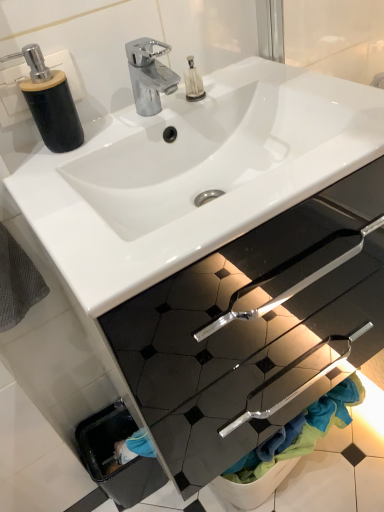
Describe the element at coordinates (48, 101) in the screenshot. The image size is (384, 512). I see `matte black soap dispenser at upper left` at that location.

The width and height of the screenshot is (384, 512). Find the location of `white glossy sink at center`. white glossy sink at center is located at coordinates (193, 174).

Which object is further away from the camera, white glossy sink at center or gray textured towel at lower left?

gray textured towel at lower left.

In the scene shown: Is white glossy sink at center to the left of gray textured towel at lower left from the viewer's perspective?

In fact, white glossy sink at center is to the right of gray textured towel at lower left.

From a real-world perspective, which object stands above the other?

From a 3D spatial view, gray textured towel at lower left is above.

Are white glossy sink at center and gray textured towel at lower left beside each other?

No, white glossy sink at center is not in contact with gray textured towel at lower left.

From the image's perspective, is white glossy sink at center beneath matte black soap dispenser at upper left?

Indeed, from the image's perspective, white glossy sink at center is shown beneath matte black soap dispenser at upper left.

Is there a large distance between white glossy sink at center and matte black soap dispenser at upper left?

white glossy sink at center is near matte black soap dispenser at upper left, not far away.

Is the depth of white glossy sink at center less than that of matte black soap dispenser at upper left?

Yes, white glossy sink at center is closer to the camera.

Is white glossy sink at center aimed at matte black soap dispenser at upper left?

No.

From a real-world perspective, is gray textured towel at lower left physically above white glossy sink at center?

Correct, in the physical world, gray textured towel at lower left is higher than white glossy sink at center.

At what (x,y) coordinates should I click in order to perform the action: click on sink above the gray textured towel at lower left (from the image's perspective). Please return your answer as a coordinate pair (x, y). Looking at the image, I should click on (193, 174).

Is gray textured towel at lower left far from white glossy sink at center?

No, there isn't a large distance between gray textured towel at lower left and white glossy sink at center.

Can you tell me how much matte black soap dispenser at upper left and gray textured towel at lower left differ in facing direction?

The facing directions of matte black soap dispenser at upper left and gray textured towel at lower left are 0.981 degrees apart.

Considering the positions of points (47, 92) and (26, 281), is point (47, 92) closer to camera compared to point (26, 281)?

Yes.

Which object is wider, matte black soap dispenser at upper left or gray textured towel at lower left?

Wider between the two is gray textured towel at lower left.

Is matte black soap dispenser at upper left looking in the opposite direction of gray textured towel at lower left?

No, gray textured towel at lower left is not at the back of matte black soap dispenser at upper left.

You are a GUI agent. You are given a task and a screenshot of the screen. Output one action in this format:
    pyautogui.click(x=<x>, y=<y>)
    Task: Click on the soap dispenser above the white glossy sink at center (from a real-world perspective)
    This screenshot has height=512, width=384.
    Given the screenshot: What is the action you would take?
    pyautogui.click(x=48, y=101)

How distant is matte black soap dispenser at upper left from white glossy sink at center?

The distance of matte black soap dispenser at upper left from white glossy sink at center is 9.32 inches.

Based on the photo, based on their sizes in the image, would you say matte black soap dispenser at upper left is bigger or smaller than white glossy sink at center?

In the image, matte black soap dispenser at upper left appears to be smaller than white glossy sink at center.

Considering the relative positions of matte black soap dispenser at upper left and white glossy sink at center in the image provided, is matte black soap dispenser at upper left in front of white glossy sink at center?

No, matte black soap dispenser at upper left is further to the viewer.

Is point (38, 276) farther from viewer compared to point (66, 86)?

Yes, point (38, 276) is behind point (66, 86).

Image resolution: width=384 pixels, height=512 pixels. I want to click on bath towel on the left of matte black soap dispenser at upper left, so click(17, 282).

How distant is gray textured towel at lower left from matte black soap dispenser at upper left?

gray textured towel at lower left is 9.35 inches away from matte black soap dispenser at upper left.

Locate an element on the screen. This screenshot has height=512, width=384. bath towel that appears below the white glossy sink at center (from the image's perspective) is located at coordinates (17, 282).

What are the coordinates of `soap dispenser behind the white glossy sink at center` in the screenshot? It's located at (48, 101).

When comparing their distances from matte black soap dispenser at upper left, does white glossy sink at center or gray textured towel at lower left seem further?

Based on the image, gray textured towel at lower left appears to be further to matte black soap dispenser at upper left.

Which object lies nearer to the anchor point matte black soap dispenser at upper left, gray textured towel at lower left or white glossy sink at center?

white glossy sink at center is positioned closer to the anchor matte black soap dispenser at upper left.

Estimate the real-world distances between objects in this image. Which object is closer to gray textured towel at lower left, white glossy sink at center or matte black soap dispenser at upper left?

matte black soap dispenser at upper left lies closer to gray textured towel at lower left than the other object.

Which object lies further to the anchor point white glossy sink at center, gray textured towel at lower left or matte black soap dispenser at upper left?

Among the two, gray textured towel at lower left is located further to white glossy sink at center.

Looking at the image, which one is located further to white glossy sink at center, matte black soap dispenser at upper left or gray textured towel at lower left?

Among the two, gray textured towel at lower left is located further to white glossy sink at center.

When comparing their distances from gray textured towel at lower left, does matte black soap dispenser at upper left or white glossy sink at center seem further?

Based on the image, white glossy sink at center appears to be further to gray textured towel at lower left.

Where is `soap dispenser located between gray textured towel at lower left and white glossy sink at center in the left-right direction`? The width and height of the screenshot is (384, 512). soap dispenser located between gray textured towel at lower left and white glossy sink at center in the left-right direction is located at coordinates (48, 101).